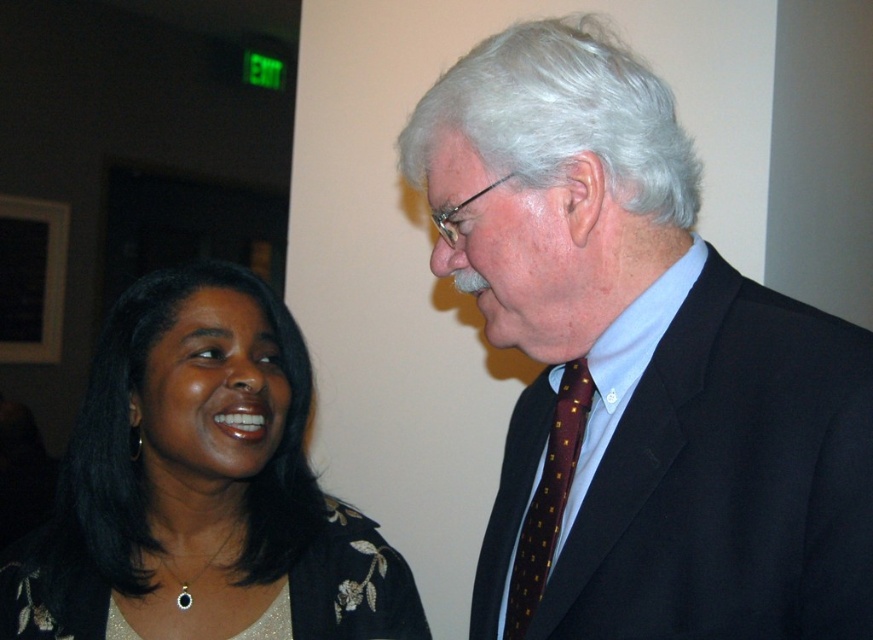
Question: Is black satin blouse at lower left thinner than satin black dress at lower left?

Choices:
 (A) no
 (B) yes

Answer: (B)

Question: Is black satin blouse at lower left wider than satin black dress at lower left?

Choices:
 (A) no
 (B) yes

Answer: (A)

Question: Which of the following is the farthest from the observer?

Choices:
 (A) (328, 516)
 (B) (568, 433)
 (C) (528, 301)

Answer: (A)

Question: Is satin black dress at lower left wider than maroon dotted tie at right?

Choices:
 (A) yes
 (B) no

Answer: (A)

Question: Which object appears closest to the camera in this image?

Choices:
 (A) maroon dotted tie at right
 (B) black satin blouse at lower left

Answer: (A)

Question: Which of these objects is positioned farthest from the maroon dotted tie at right?

Choices:
 (A) satin black dress at lower left
 (B) black satin blouse at lower left
 (C) dark blue suit at center

Answer: (B)